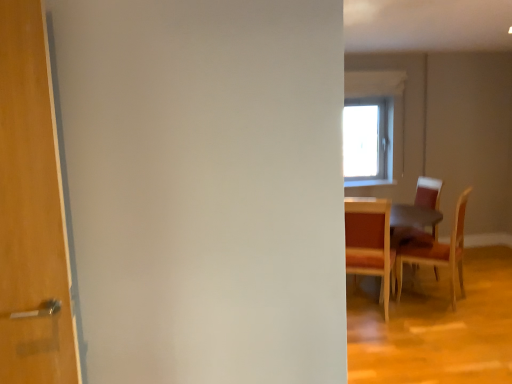
Question: Should I look upward or downward to see wooden table at right?

Choices:
 (A) down
 (B) up

Answer: (A)

Question: Considering the relative sizes of wooden chair at right, the 1th chair in the left-to-right sequence, and wooden table at right in the image provided, is wooden chair at right, the 1th chair in the left-to-right sequence, bigger than wooden table at right?

Choices:
 (A) no
 (B) yes

Answer: (A)

Question: Does wooden chair at right, the 1th chair in the left-to-right sequence, lie in front of wooden table at right?

Choices:
 (A) no
 (B) yes

Answer: (B)

Question: From the image's perspective, would you say wooden chair at right, which is counted as the 3th chair, starting from the right, is shown under wooden table at right?

Choices:
 (A) no
 (B) yes

Answer: (A)

Question: From a real-world perspective, is wooden chair at right, the 1th chair in the left-to-right sequence, below wooden table at right?

Choices:
 (A) no
 (B) yes

Answer: (A)

Question: Is wooden chair at right, which is counted as the 3th chair, starting from the right, thinner than wooden table at right?

Choices:
 (A) no
 (B) yes

Answer: (B)

Question: Is wooden chair at right, which is counted as the 3th chair, starting from the right, at the right side of wooden table at right?

Choices:
 (A) yes
 (B) no

Answer: (B)

Question: Can we say wooden table at right lies outside wooden chair at right, which is the 3th chair from left to right?

Choices:
 (A) no
 (B) yes

Answer: (B)

Question: Does wooden table at right have a lesser width compared to wooden chair at right, which is the 3th chair from left to right?

Choices:
 (A) no
 (B) yes

Answer: (A)

Question: Can you confirm if wooden table at right is shorter than wooden chair at right, the 1th chair positioned from the right?

Choices:
 (A) yes
 (B) no

Answer: (A)

Question: Does wooden table at right appear on the right side of wooden chair at right, which is the 3th chair from left to right?

Choices:
 (A) no
 (B) yes

Answer: (A)

Question: From the image's perspective, would you say wooden table at right is positioned over wooden chair at right, which is the 3th chair from left to right?

Choices:
 (A) yes
 (B) no

Answer: (B)

Question: Is wooden table at right aimed at wooden chair at right, which is the 3th chair from left to right?

Choices:
 (A) yes
 (B) no

Answer: (A)

Question: Is wooden table at right facing away from wooden chair at right, the 1th chair in the left-to-right sequence?

Choices:
 (A) no
 (B) yes

Answer: (A)